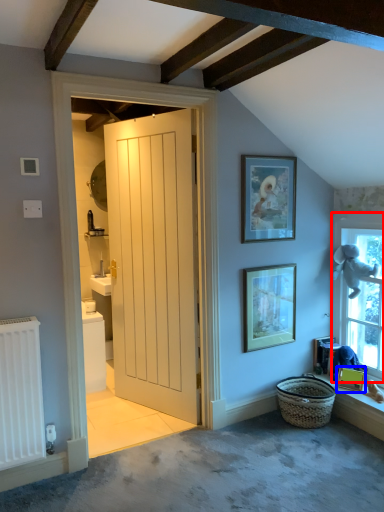
Question: Among these objects, which one is farthest to the camera, window (highlighted by a red box) or picture frame (highlighted by a blue box)?

Choices:
 (A) window
 (B) picture frame

Answer: (B)